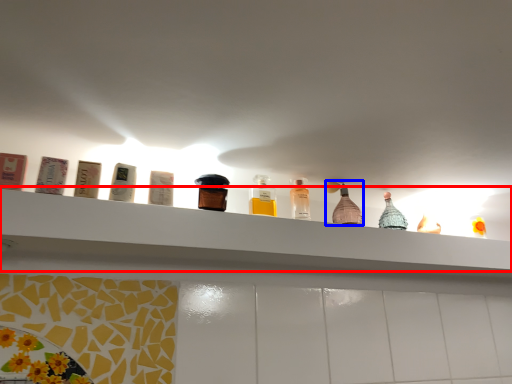
Question: Which object appears closest to the camera in this image, shelf (highlighted by a red box) or bottle (highlighted by a blue box)?

Choices:
 (A) shelf
 (B) bottle

Answer: (A)